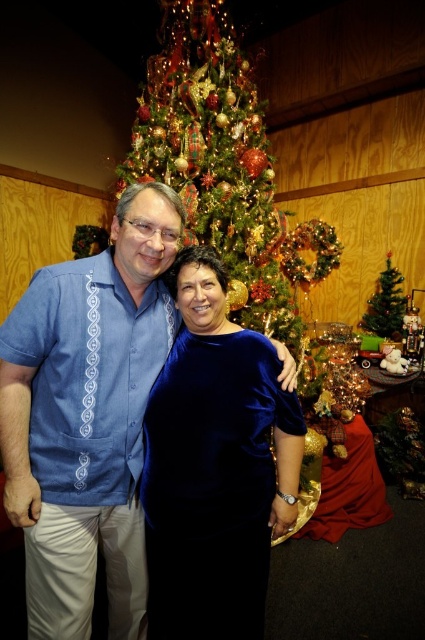
You are taking a photo of the two people in the scene. The camera is positioned such that you can see both people clearly. If you want to focus on the person closer to the camera, which of the two points, point (x=166, y=209) or point (x=376, y=305), should you adjust the camera focus to?

Point (x=166, y=209) is closer to the camera than point (x=376, y=305), so you should adjust the camera focus to point (x=166, y=209) to focus on the person closer to the camera.

You are a photographer trying to capture a photo of both the blue satin blouse at center and the velvet blue dress at center. Which one should you focus on first if you want to ensure both are in the frame without moving the camera?

You should focus on the velvet blue dress at center first because the blue satin blouse at center is to the left of it, so by centering the dress, the blouse will naturally be included in the frame to its left without needing to adjust the camera position.